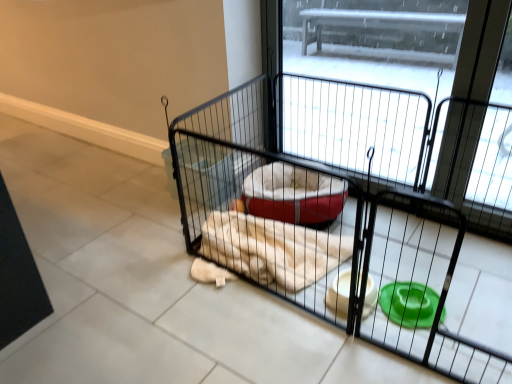
In order to click on black wire screen door at center in this screenshot , I will do `click(488, 49)`.

Measure the distance between point (478, 38) and camera.

The distance of point (478, 38) from camera is 5.17 feet.

This screenshot has height=384, width=512. What do you see at coordinates (488, 49) in the screenshot?
I see `black wire screen door at center` at bounding box center [488, 49].

Describe the element at coordinates (334, 213) in the screenshot. Image resolution: width=512 pixels, height=384 pixels. I see `black wire cage at center` at that location.

This screenshot has height=384, width=512. In order to click on black wire cage at center in this screenshot , I will do `click(334, 213)`.

Measure the distance between black wire cage at center and camera.

The distance of black wire cage at center from camera is 1.21 meters.

This screenshot has width=512, height=384. In order to click on black wire screen door at center in this screenshot , I will do `click(488, 49)`.

Which is more to the right, black wire screen door at center or black wire cage at center?

From the viewer's perspective, black wire screen door at center appears more on the right side.

Is black wire screen door at center closer to camera compared to black wire cage at center?

No, the depth of black wire screen door at center is greater than that of black wire cage at center.

Is point (454, 186) in front of point (262, 257)?

No, it is behind (262, 257).

From the image's perspective, is black wire screen door at center beneath black wire cage at center?

No.

From a real-world perspective, is black wire screen door at center over black wire cage at center?

Yes, from a real-world perspective, black wire screen door at center is over black wire cage at center

Is black wire screen door at center thinner than black wire cage at center?

Yes.

Who is taller, black wire screen door at center or black wire cage at center?

black wire screen door at center is taller.

Considering the relative sizes of black wire screen door at center and black wire cage at center in the image provided, is black wire screen door at center bigger than black wire cage at center?

No, black wire screen door at center is not bigger than black wire cage at center.

Which is correct: black wire screen door at center is inside black wire cage at center, or outside of it?

black wire screen door at center is not inside black wire cage at center, it's outside.

Is there a large distance between black wire screen door at center and black wire cage at center?

No, black wire screen door at center is not far away from black wire cage at center.

Is black wire cage at center at the back of black wire screen door at center?

Yes, black wire screen door at center is positioned with its back facing black wire cage at center.

How different are the orientations of black wire screen door at center and black wire cage at center in degrees?

The angular difference between black wire screen door at center and black wire cage at center is 1.45 degrees.

How distant is black wire screen door at center from black wire cage at center?

The distance of black wire screen door at center from black wire cage at center is 67.20 centimeters.

The width and height of the screenshot is (512, 384). Find the location of `screen door above the black wire cage at center (from the image's perspective)`. screen door above the black wire cage at center (from the image's perspective) is located at coordinates (488, 49).

Would you say black wire cage at center is to the left or to the right of black wire screen door at center in the picture?

From the image, it's evident that black wire cage at center is to the left of black wire screen door at center.

In the image, is black wire cage at center positioned in front of or behind black wire screen door at center?

black wire cage at center is positioned closer to the viewer than black wire screen door at center.

Is point (387, 185) farther from viewer compared to point (270, 9)?

Yes, it is behind point (270, 9).

From the image's perspective, which one is positioned lower, black wire cage at center or black wire screen door at center?

black wire cage at center appears lower in the image.

From a real-world perspective, between black wire cage at center and black wire screen door at center, who is vertically lower?

From a 3D spatial view, black wire cage at center is below.

Can you confirm if black wire cage at center is thinner than black wire screen door at center?

Incorrect, the width of black wire cage at center is not less than that of black wire screen door at center.

Can you confirm if black wire cage at center is taller than black wire screen door at center?

In fact, black wire cage at center may be shorter than black wire screen door at center.

Can you confirm if black wire cage at center is bigger than black wire screen door at center?

Indeed, black wire cage at center has a larger size compared to black wire screen door at center.

Do you think black wire cage at center is within black wire screen door at center, or outside of it?

The correct answer is: outside.

Can you see black wire cage at center touching black wire screen door at center?

They are not placed beside each other.

Consider the image. Could you tell me if black wire cage at center is facing black wire screen door at center?

No, black wire cage at center is not turned towards black wire screen door at center.

How different are the orientations of black wire cage at center and black wire screen door at center in degrees?

1.45 degrees separate the facing orientations of black wire cage at center and black wire screen door at center.

The width and height of the screenshot is (512, 384). In order to click on screen door located behind the black wire cage at center in this screenshot , I will do `click(488, 49)`.

I want to click on cage located underneath the black wire screen door at center (from a real-world perspective), so click(334, 213).

Where is `screen door above the black wire cage at center (from the image's perspective)`? screen door above the black wire cage at center (from the image's perspective) is located at coordinates (488, 49).